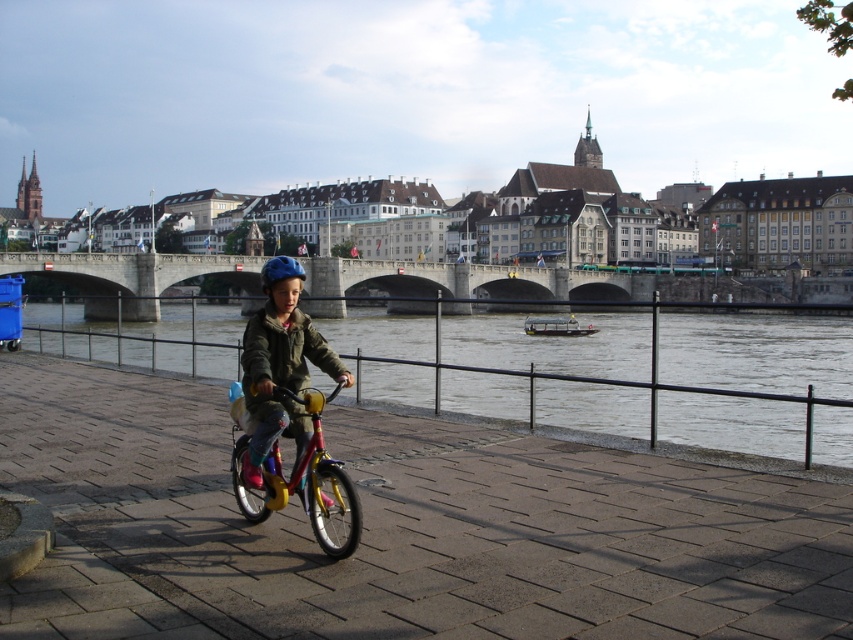
Question: Can you confirm if stone bridge at center is wider than metallic yellow bicycle at center?

Choices:
 (A) yes
 (B) no

Answer: (A)

Question: Does smooth concrete river at center have a lesser width compared to matte blue helmet at center?

Choices:
 (A) no
 (B) yes

Answer: (A)

Question: Which of the following is the closest to the observer?

Choices:
 (A) (254, 412)
 (B) (287, 262)
 (C) (347, 536)
 (D) (202, 323)

Answer: (C)

Question: Which object is positioned farthest from the smooth concrete river at center?

Choices:
 (A) matte blue helmet at center
 (B) blue matte helmet at center
 (C) stone bridge at center
 (D) metallic yellow bicycle at center

Answer: (D)

Question: Can you confirm if smooth concrete river at center is smaller than metallic yellow bicycle at center?

Choices:
 (A) no
 (B) yes

Answer: (A)

Question: Which of the following is the farthest from the observer?

Choices:
 (A) (271, 342)
 (B) (260, 284)
 (C) (704, 358)

Answer: (B)